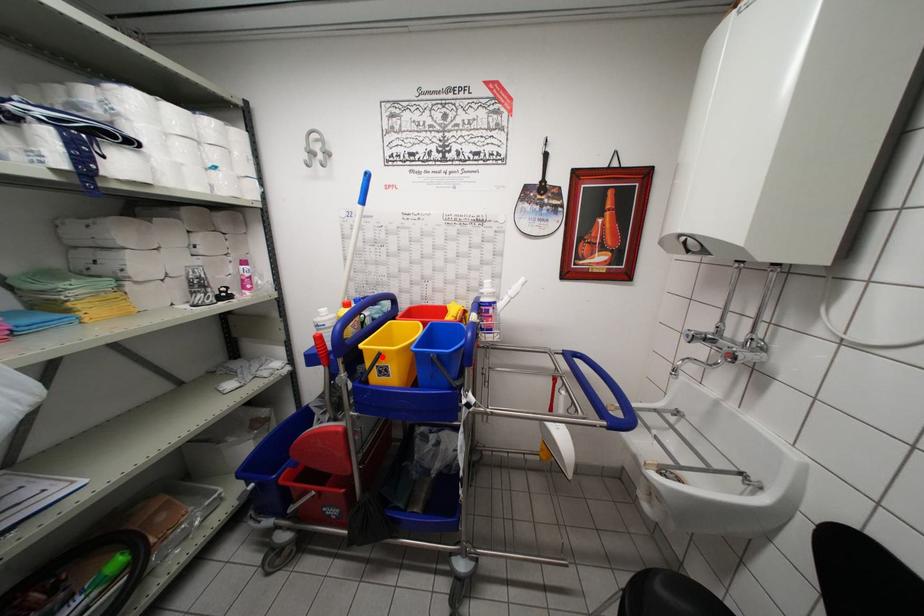
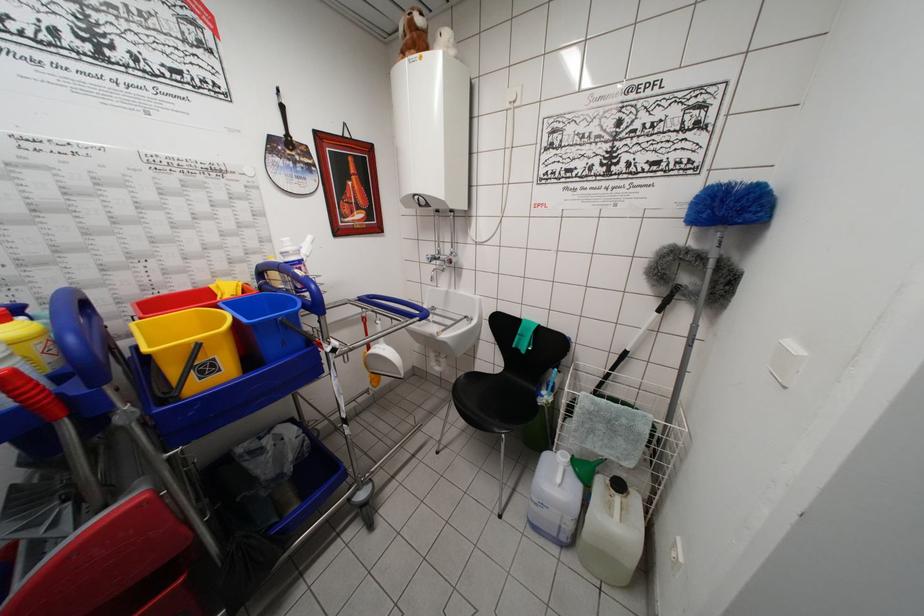
Find the pixel in the second image that matches the highlighted location in the first image.

(200, 349)